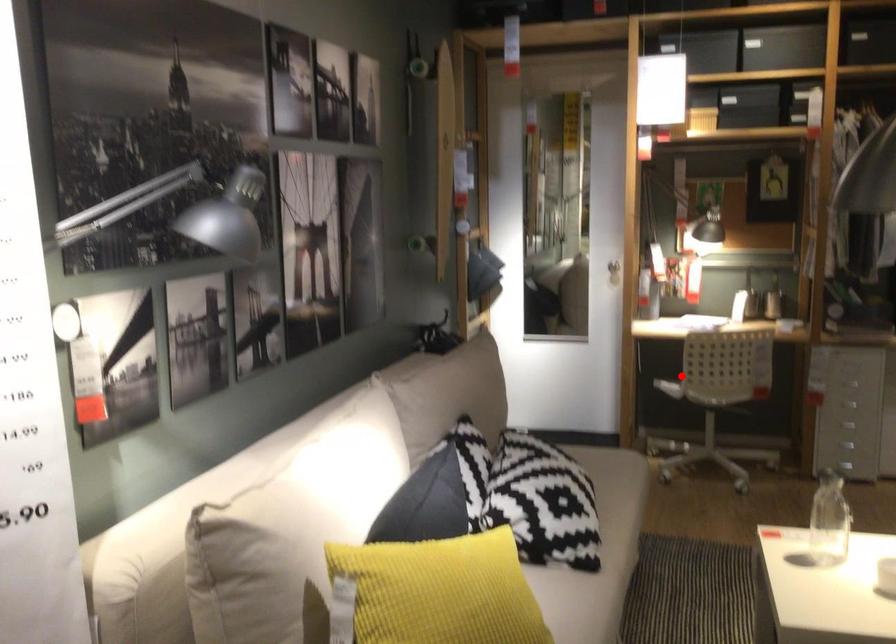
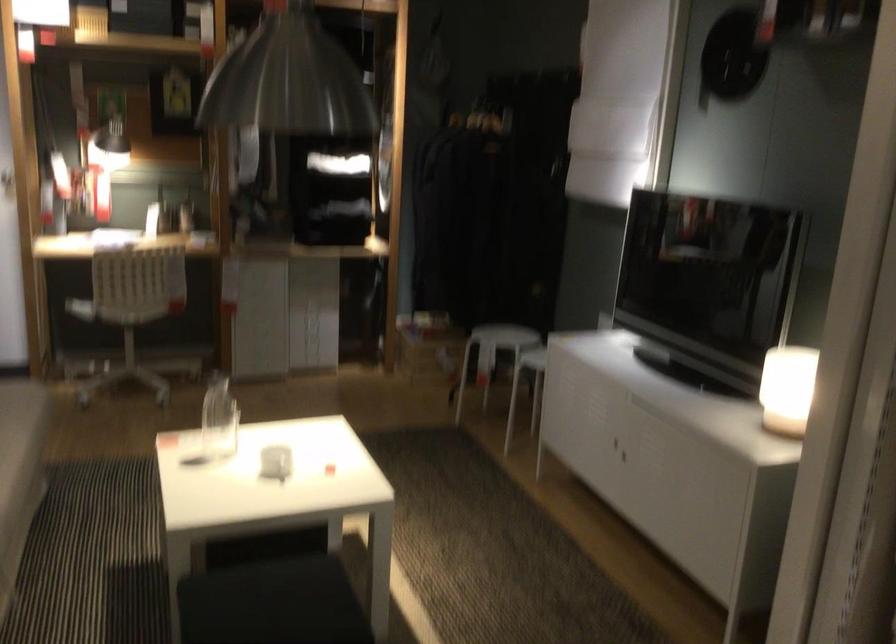
Locate, in the second image, the point that corresponds to the highlighted location in the first image.

(80, 308)